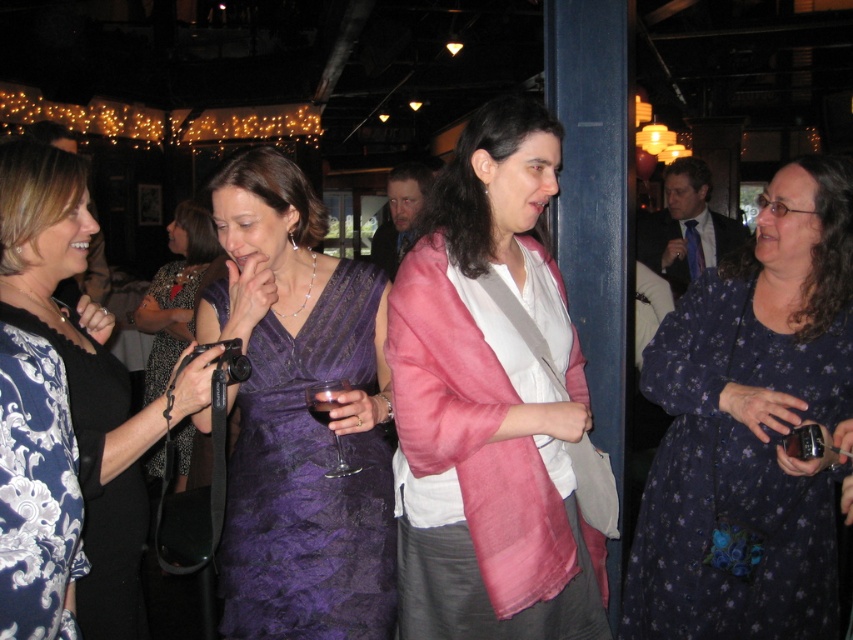
Between point (544, 493) and point (129, 476), which one is positioned behind?

Point (544, 493)

This screenshot has width=853, height=640. I want to click on pink silk jacket at center, so (x=491, y=403).

Looking at this image, can you confirm if purple satin dress at center is positioned to the right of purple lace dress at center?

Yes, purple satin dress at center is to the right of purple lace dress at center.

Where is `purple satin dress at center`? The height and width of the screenshot is (640, 853). purple satin dress at center is located at coordinates click(x=299, y=417).

The image size is (853, 640). In order to click on purple satin dress at center in this screenshot , I will do `click(299, 417)`.

Does dark blue floral dress at center appear over dark red glass at center?

Actually, dark blue floral dress at center is below dark red glass at center.

Between point (808, 296) and point (312, 403), which one is positioned in front?

Point (312, 403) is more forward.

The width and height of the screenshot is (853, 640). Identify the location of dark blue floral dress at center. (750, 428).